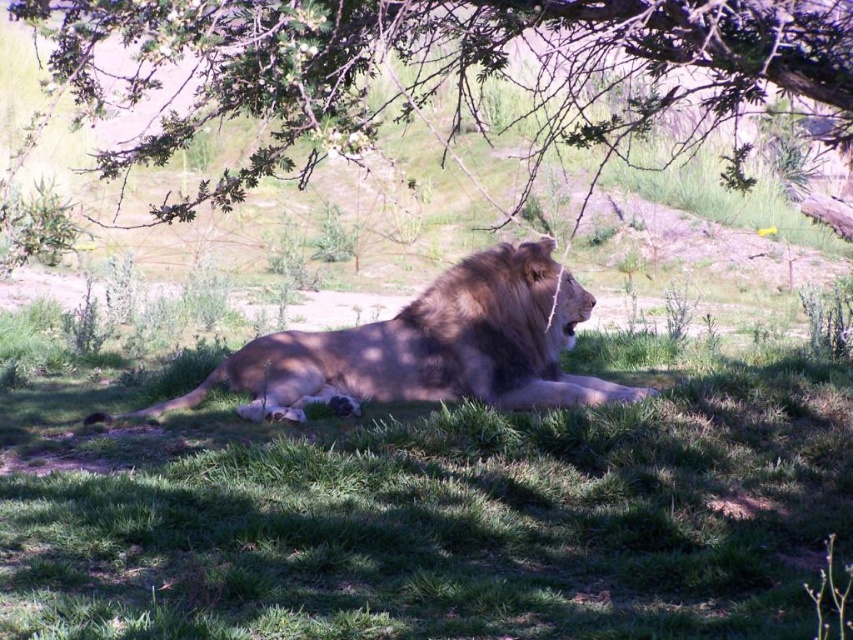
You are a small rabbit hiding from a predator in the savanna. You see the green grassy at center and the green leafy branches at upper center. Which location offers better cover based on their height?

The green leafy branches at upper center provide better cover because they are taller than the green grassy at center.

You are a photographer trying to capture the golden brown fur lion at center. You notice the green grassy at center is blocking part of the lion. Can you adjust your position to avoid the grass while still framing the lion?

The green grassy at center is positioned under the golden brown fur lion at center, so moving your camera position slightly upwards or backwards could allow you to frame the lion without the grass blocking it.

You are a small rabbit hiding in the green grassy at center. Can you see the golden brown fur lion at center from your hiding spot?

The green grassy at center has a lesser height compared to golden brown fur lion at center, so the rabbit cannot hide effectively and would be visible to the lion.